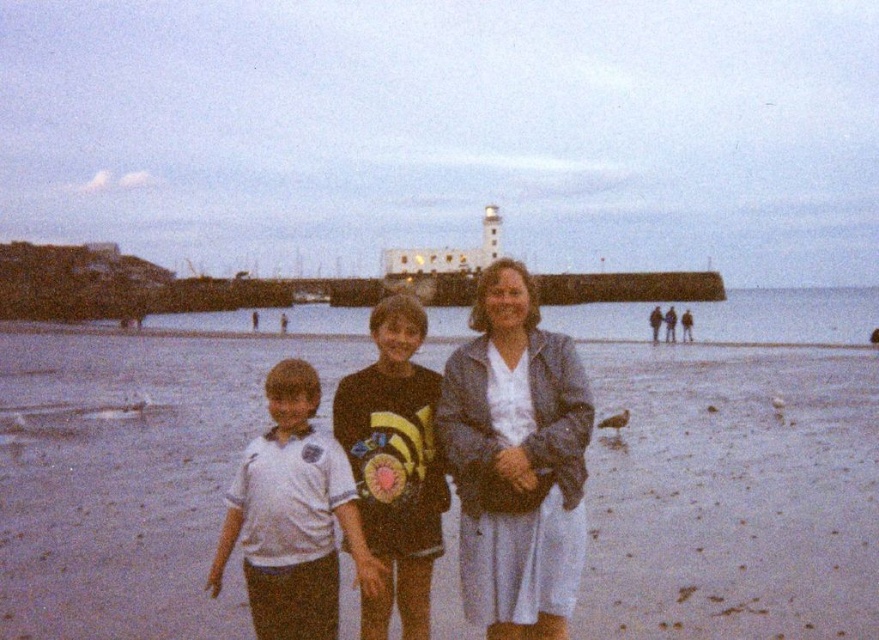
Question: Considering the real-world distances, which object is farthest from the matte gray jacket at center?

Choices:
 (A) white sand at center
 (B) light blue fabric dress at center

Answer: (B)

Question: Which of the following is the closest to the observer?

Choices:
 (A) white sand at center
 (B) white cotton shirt at center
 (C) light blue fabric dress at center

Answer: (A)

Question: Observing the image, what is the correct spatial positioning of white cotton shirt at center in reference to matte gray jacket at center?

Choices:
 (A) below
 (B) above

Answer: (A)

Question: Is white sand at center smaller than white cotton shirt at center?

Choices:
 (A) yes
 (B) no

Answer: (B)

Question: From the image, what is the correct spatial relationship of white sand at center in relation to matte gray jacket at center?

Choices:
 (A) above
 (B) below

Answer: (B)

Question: Which point is farther to the camera?

Choices:
 (A) (574, 461)
 (B) (440, 483)
 (C) (650, 323)

Answer: (C)